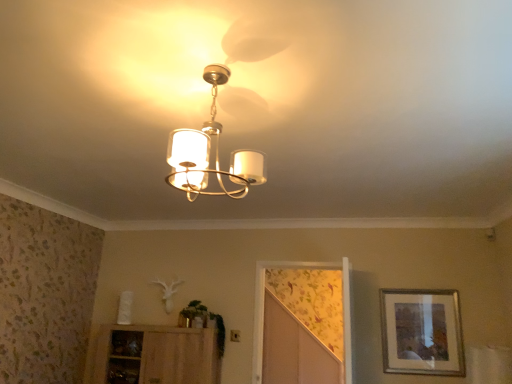
Question: Is matte white chandelier at center not inside silver metallic picture frame at right?

Choices:
 (A) yes
 (B) no

Answer: (A)

Question: Is matte white chandelier at center thinner than silver metallic picture frame at right?

Choices:
 (A) yes
 (B) no

Answer: (B)

Question: From the image's perspective, does matte white chandelier at center appear lower than silver metallic picture frame at right?

Choices:
 (A) yes
 (B) no

Answer: (B)

Question: Would you say matte white chandelier at center contains silver metallic picture frame at right?

Choices:
 (A) yes
 (B) no

Answer: (B)

Question: Is matte white chandelier at center behind silver metallic picture frame at right?

Choices:
 (A) yes
 (B) no

Answer: (B)

Question: From the image's perspective, is floral wallpaper screen door at center positioned above or below wooden cabinet at lower left?

Choices:
 (A) above
 (B) below

Answer: (A)

Question: From a real-world perspective, relative to wooden cabinet at lower left, is floral wallpaper screen door at center vertically above or below?

Choices:
 (A) below
 (B) above

Answer: (B)

Question: Choose the correct answer: Is floral wallpaper screen door at center inside wooden cabinet at lower left or outside it?

Choices:
 (A) inside
 (B) outside

Answer: (B)

Question: Based on their positions, is floral wallpaper screen door at center located to the left or right of wooden cabinet at lower left?

Choices:
 (A) left
 (B) right

Answer: (B)

Question: Does point (309, 362) appear closer or farther from the camera than point (216, 162)?

Choices:
 (A) farther
 (B) closer

Answer: (A)

Question: In terms of height, does floral wallpaper screen door at center look taller or shorter compared to matte white chandelier at center?

Choices:
 (A) short
 (B) tall

Answer: (B)

Question: In the image, is floral wallpaper screen door at center positioned in front of or behind matte white chandelier at center?

Choices:
 (A) behind
 (B) front

Answer: (A)

Question: From the image's perspective, relative to matte white chandelier at center, is floral wallpaper screen door at center above or below?

Choices:
 (A) above
 (B) below

Answer: (B)

Question: In the image, is matte white chandelier at center positioned in front of or behind floral wallpaper screen door at center?

Choices:
 (A) front
 (B) behind

Answer: (A)

Question: Would you say matte white chandelier at center is inside or outside floral wallpaper screen door at center?

Choices:
 (A) outside
 (B) inside

Answer: (A)